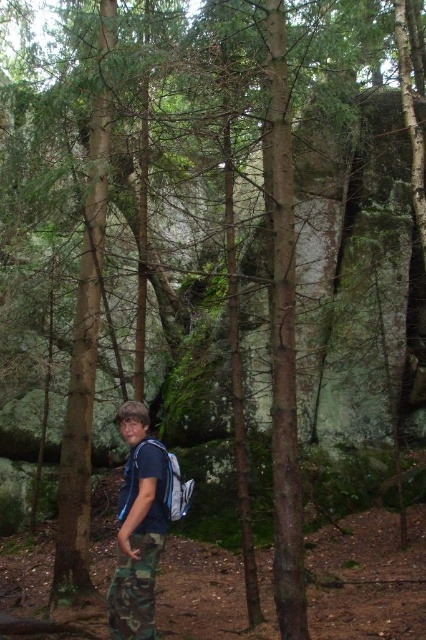
Can you confirm if camouflage pants at lower center is positioned above matte blue backpack at center?

Actually, camouflage pants at lower center is below matte blue backpack at center.

Does camouflage pants at lower center have a smaller size compared to matte blue backpack at center?

Indeed, camouflage pants at lower center has a smaller size compared to matte blue backpack at center.

Find the location of a particular element. The width and height of the screenshot is (426, 640). camouflage pants at lower center is located at coordinates point(135,589).

Locate an element on the screen. The width and height of the screenshot is (426, 640). camouflage pants at lower center is located at coordinates (135, 589).

Who is lower down, camo pants at center or matte blue backpack at center?

Positioned lower is camo pants at center.

Which is above, camo pants at center or matte blue backpack at center?

matte blue backpack at center

Is point (152, 490) farther from viewer compared to point (192, 493)?

No.

At what (x,y) coordinates should I click in order to perform the action: click on camo pants at center. Please return your answer as a coordinate pair (x, y). The width and height of the screenshot is (426, 640). Looking at the image, I should click on (138, 528).

Does camo pants at center appear over camouflage pants at lower center?

Indeed, camo pants at center is positioned over camouflage pants at lower center.

Is camo pants at center further to the viewer compared to camouflage pants at lower center?

Yes, it is.

In order to click on camo pants at center in this screenshot , I will do `click(138, 528)`.

The width and height of the screenshot is (426, 640). I want to click on camo pants at center, so click(x=138, y=528).